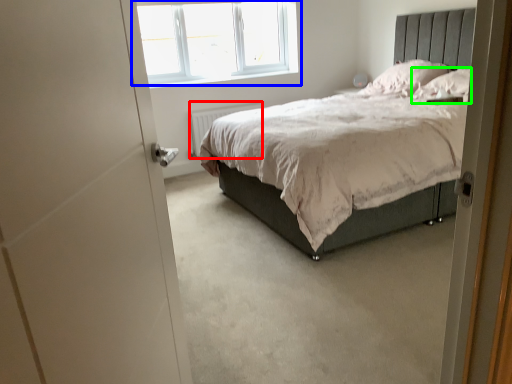
Question: Estimate the real-world distances between objects in this image. Which object is closer to radiator (highlighted by a red box), window (highlighted by a blue box) or pillow (highlighted by a green box)?

Choices:
 (A) window
 (B) pillow

Answer: (A)